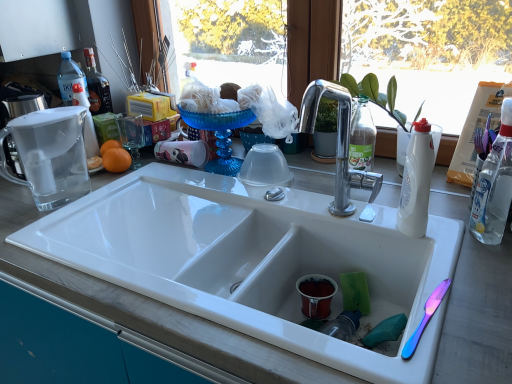
At what (x,y) coordinates should I click in order to perform the action: click on free spot to the right of clear glass pitcher at upper left. Please return your answer as a coordinate pair (x, y). Looking at the image, I should click on (124, 205).